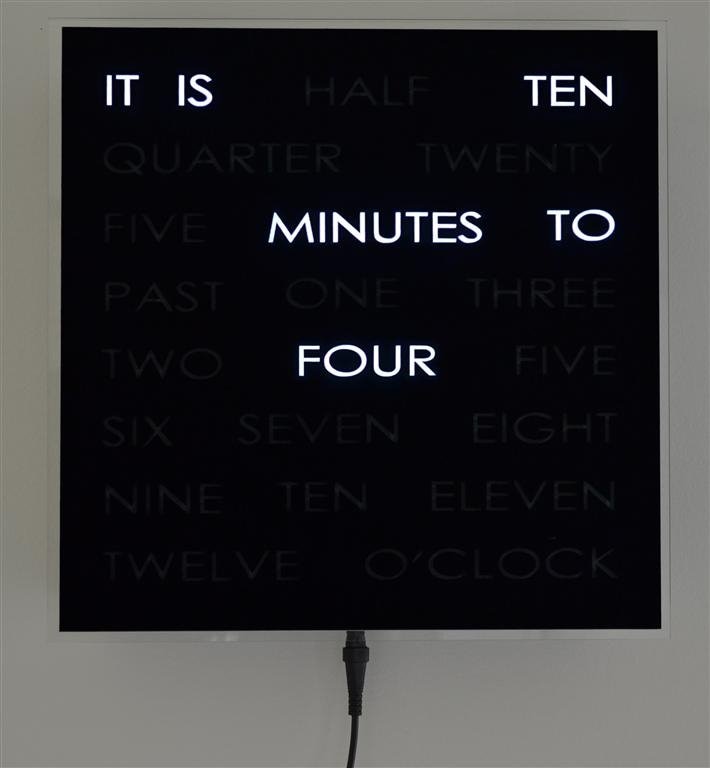
This screenshot has width=710, height=768. I want to click on digital clock, so click(356, 641).